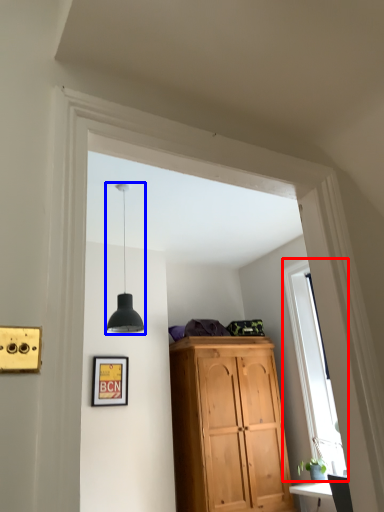
Question: Which object appears farthest to the camera in this image, window (highlighted by a red box) or light fixture (highlighted by a blue box)?

Choices:
 (A) window
 (B) light fixture

Answer: (A)